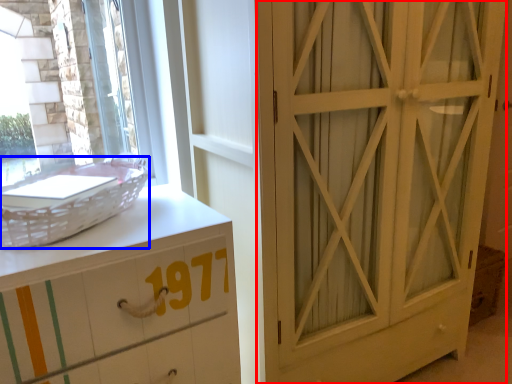
Question: Which of the following is the closest to the observer, door (highlighted by a red box) or basket (highlighted by a blue box)?

Choices:
 (A) door
 (B) basket

Answer: (B)